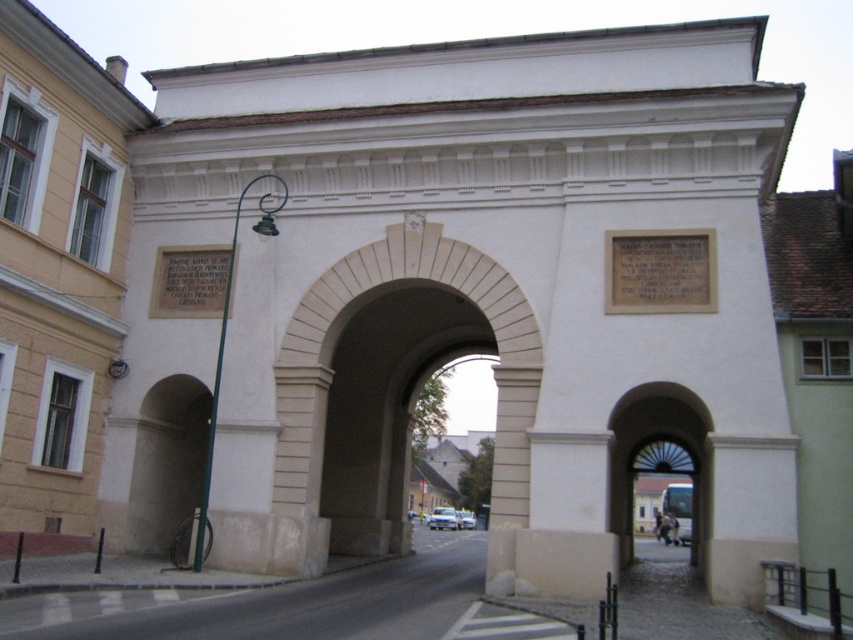
Question: Is white stone archway at center behind matte glass door at center?

Choices:
 (A) yes
 (B) no

Answer: (B)

Question: In this image, where is white stone archway at center located relative to matte glass door at center?

Choices:
 (A) above
 (B) below

Answer: (A)

Question: Is white stone archway at center to the left of matte glass door at center from the viewer's perspective?

Choices:
 (A) no
 (B) yes

Answer: (B)

Question: Which point appears closest to the camera in this image?

Choices:
 (A) (643, 524)
 (B) (512, 438)

Answer: (B)

Question: Which of the following is the farthest from the observer?

Choices:
 (A) matte glass door at center
 (B) white stone archway at center

Answer: (A)

Question: Which object is farther from the camera taking this photo?

Choices:
 (A) white stone archway at center
 (B) matte glass door at center

Answer: (B)